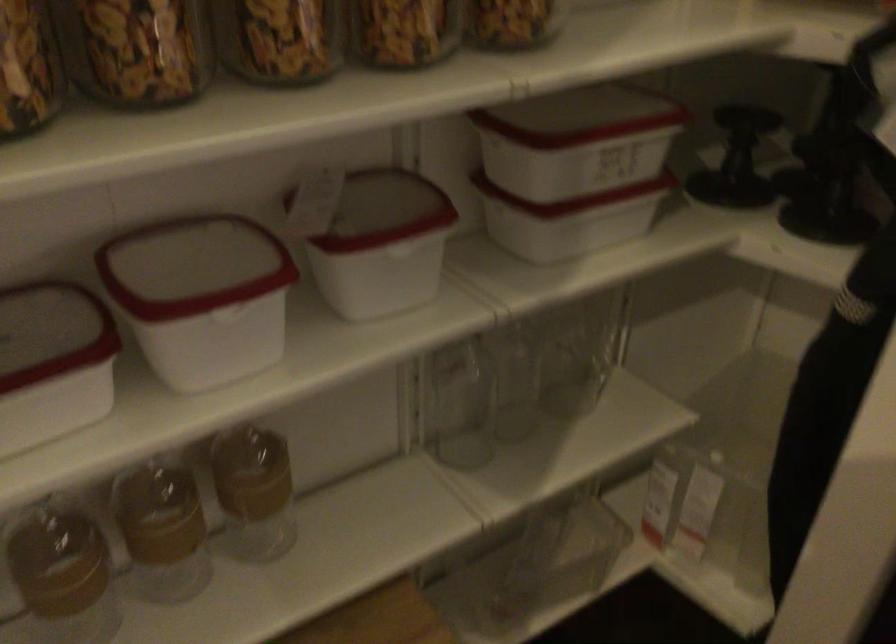
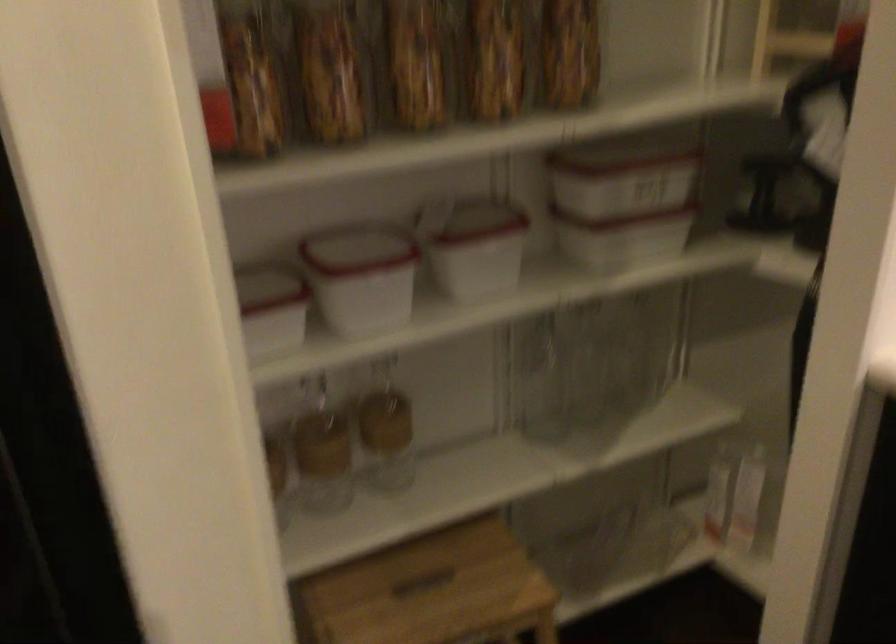
Where in the second image is the point corresponding to [254,489] from the first image?

(385, 430)